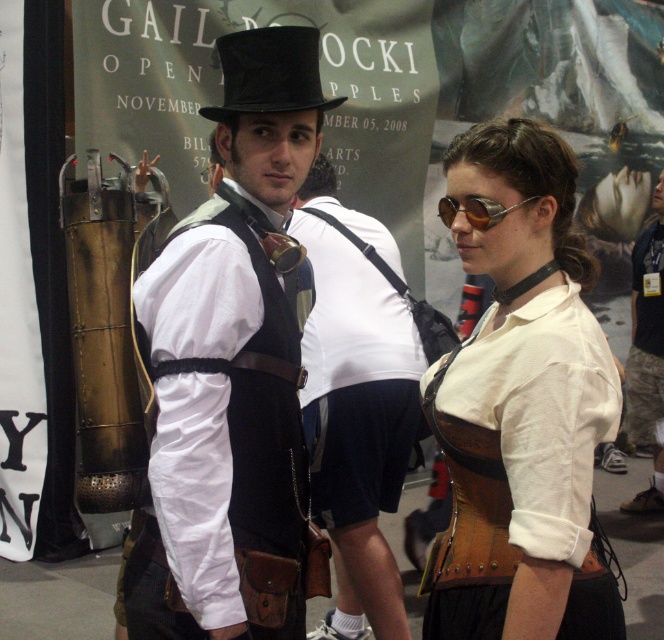
Is brushed metal tank at center taller than gold metallic goggles at center?

Yes, brushed metal tank at center is taller than gold metallic goggles at center.

Which is behind, point (645, 374) or point (471, 218)?

Point (645, 374)

At what (x,y) coordinates should I click in order to perform the action: click on brushed metal tank at center. Please return your answer as a coordinate pair (x, y). The image size is (664, 640). Looking at the image, I should click on 645,330.

Does point (299, 540) lie in front of point (274, 52)?

That is False.

Is the position of matte black vest at center more distant than that of black felt top hat at upper center?

No.

Is point (250, 250) positioned behind point (293, 64)?

Yes, it is behind point (293, 64).

This screenshot has height=640, width=664. Identify the location of matte black vest at center. (230, 368).

Can you confirm if matte black vest at center is positioned below brushed metal tank at center?

No, matte black vest at center is not below brushed metal tank at center.

Who is more forward, (x=201, y=346) or (x=643, y=429)?

Point (x=201, y=346) is in front.

This screenshot has height=640, width=664. Find the location of `matte black vest at center`. matte black vest at center is located at coordinates (230, 368).